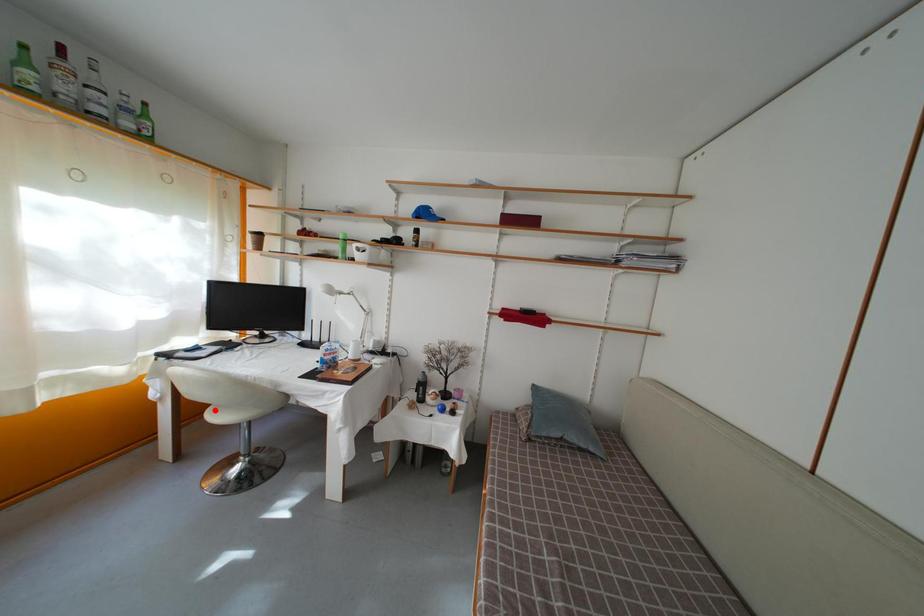
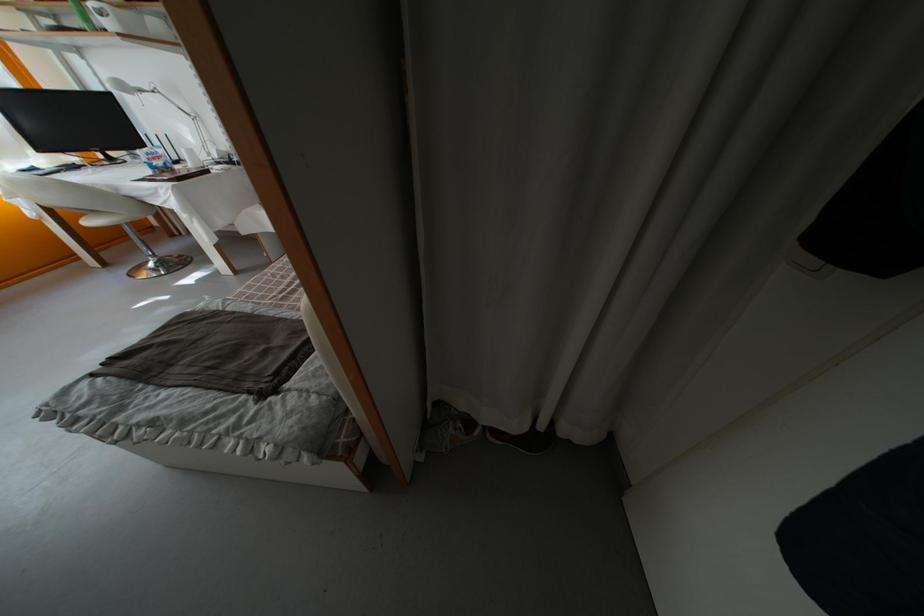
The point at the highlighted location is marked in the first image. Where is the corresponding point in the second image?

(84, 221)